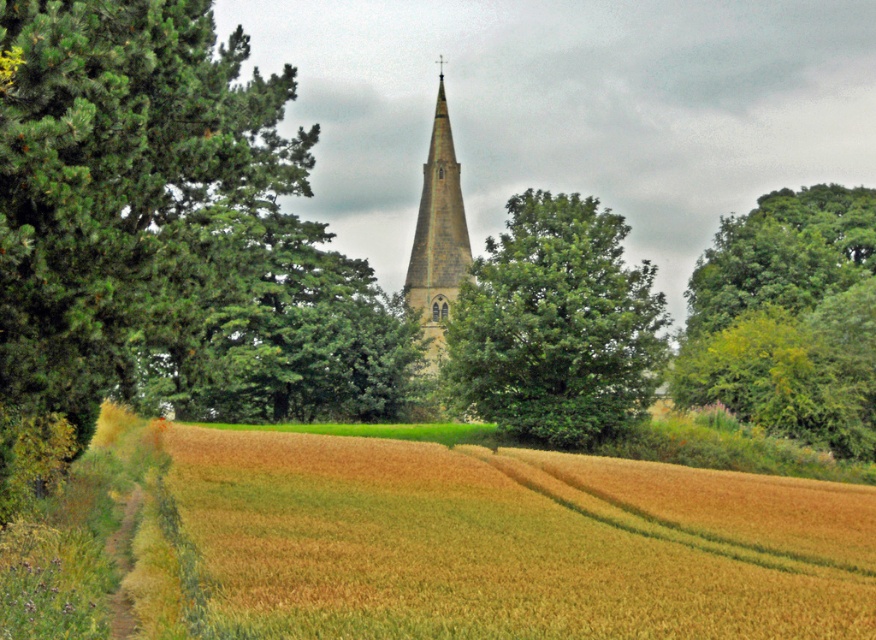
Does green leafy tree at upper right have a lesser height compared to green leafy tree at center?

No, green leafy tree at upper right is not shorter than green leafy tree at center.

Which is in front, point (682, 353) or point (484, 397)?

Point (484, 397)

Is point (858, 419) in front of point (564, 250)?

No, (858, 419) is behind (564, 250).

The width and height of the screenshot is (876, 640). I want to click on green leafy tree at upper right, so click(x=788, y=317).

Is green leafy tree at center positioned at the back of light brown stone steeple at center?

No, green leafy tree at center is in front of light brown stone steeple at center.

Does point (514, 220) come behind point (418, 301)?

No, it is in front of (418, 301).

At what (x,y) coordinates should I click in order to perform the action: click on green leafy tree at center. Please return your answer as a coordinate pair (x, y). Image resolution: width=876 pixels, height=640 pixels. Looking at the image, I should click on (557, 324).

Is golden wheat field at lower left wider than light brown stone steeple at center?

Indeed, golden wheat field at lower left has a greater width compared to light brown stone steeple at center.

Consider the image. Does golden wheat field at lower left come behind light brown stone steeple at center?

No.

What do you see at coordinates (513, 541) in the screenshot?
I see `golden wheat field at lower left` at bounding box center [513, 541].

What are the coordinates of `golden wheat field at lower left` in the screenshot? It's located at (513, 541).